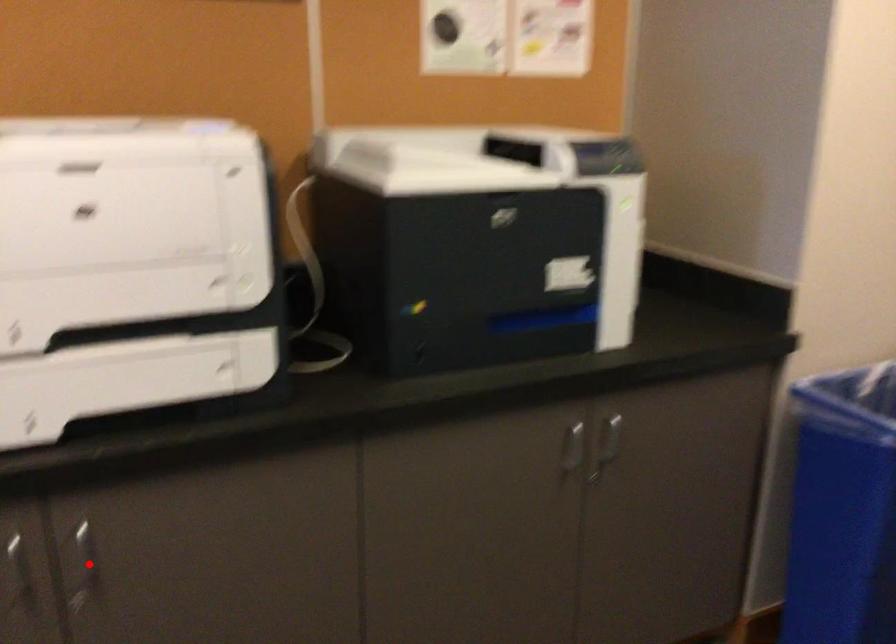
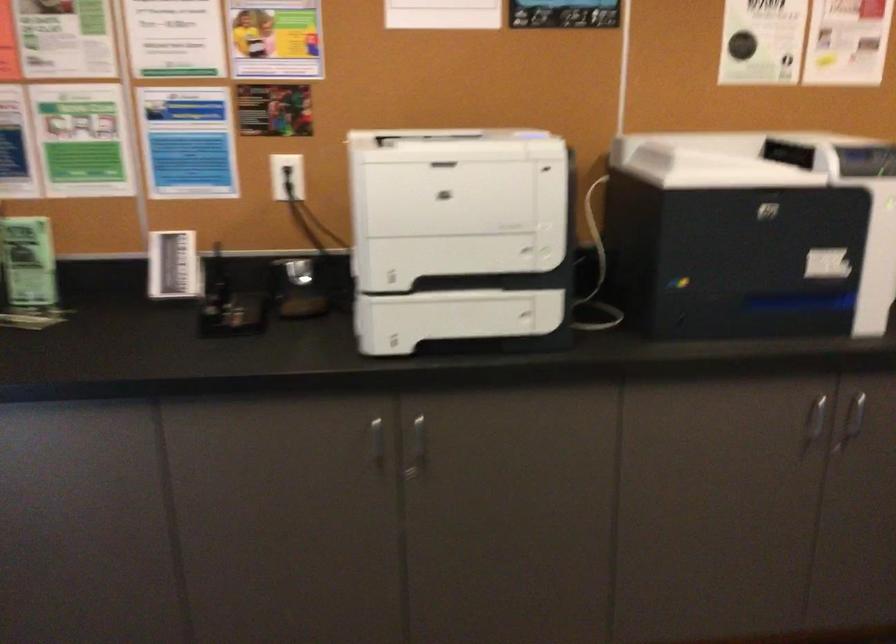
Where in the second image is the point corresponding to the highlighted location from the first image?

(417, 448)